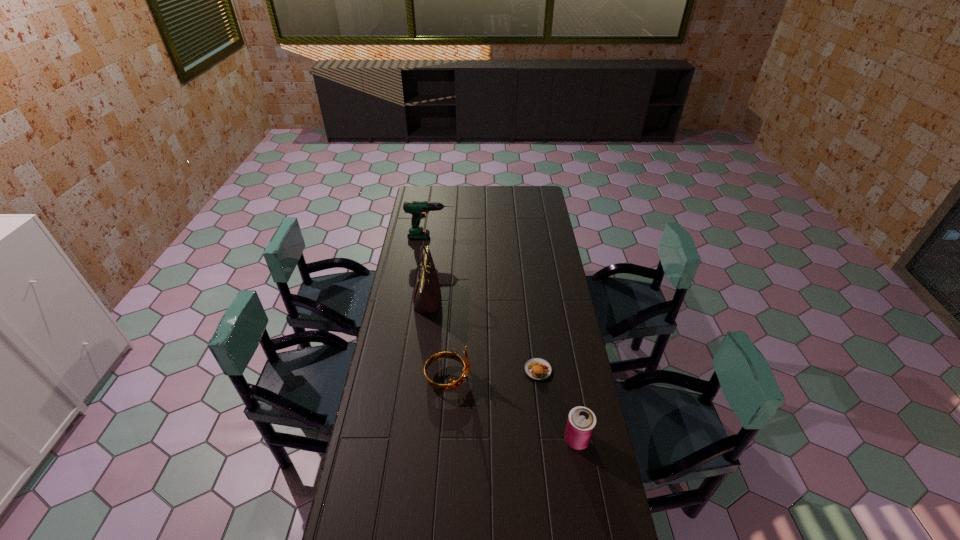
You are a GUI agent. You are given a task and a screenshot of the screen. Output one action in this format:
    pyautogui.click(x=<x>, y=<y>)
    Task: Click on the free space located on the handle side of the drill
    Image resolution: width=960 pixels, height=540 pixels.
    Given the screenshot: What is the action you would take?
    pyautogui.click(x=486, y=237)

Locate an element on the screen. vacant area situated 0.060m on the front-facing side of the third tallest object is located at coordinates (487, 379).

The width and height of the screenshot is (960, 540). I want to click on vacant region located on the left of the rightmost object, so click(x=523, y=440).

Locate an element on the screen. This screenshot has width=960, height=540. vacant position located on the left of the shortest object is located at coordinates (464, 370).

The width and height of the screenshot is (960, 540). Find the location of `handbag located in the left edge section of the desktop`. handbag located in the left edge section of the desktop is located at coordinates (426, 295).

This screenshot has height=540, width=960. In order to click on drill that is at the left edge in this screenshot , I will do `click(418, 209)`.

The height and width of the screenshot is (540, 960). Identify the location of can at the right edge. (581, 422).

Where is `patty that is at the right edge`? This screenshot has width=960, height=540. patty that is at the right edge is located at coordinates (538, 369).

In the image, there is a desktop. Identify the location of vacant space at the far edge. (488, 206).

Where is `vacant space at the left edge of the desktop`? vacant space at the left edge of the desktop is located at coordinates (383, 461).